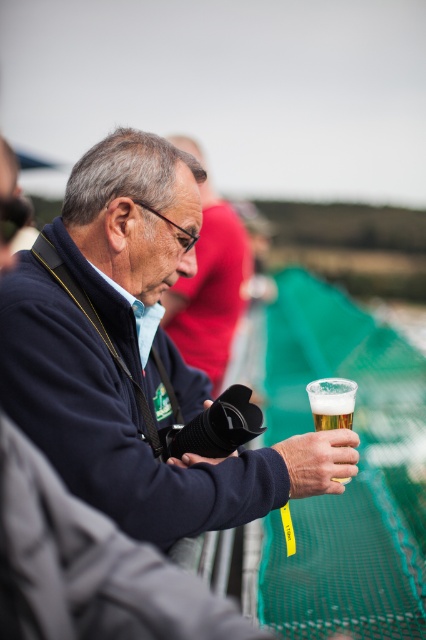
Question: Does matte black jacket at center appear on the right side of matte black camera at center?

Choices:
 (A) no
 (B) yes

Answer: (B)

Question: Based on their relative distances, which object is nearer to the matte black camera at center?

Choices:
 (A) matte black jacket at center
 (B) translucent glass at center

Answer: (A)

Question: Estimate the real-world distances between objects in this image. Which object is closer to the matte black camera at center?

Choices:
 (A) translucent glass at center
 (B) matte black jacket at center

Answer: (B)

Question: Can you confirm if matte black camera at center is smaller than translucent glass at center?

Choices:
 (A) yes
 (B) no

Answer: (B)

Question: Which object is positioned closest to the translucent glass at center?

Choices:
 (A) matte black jacket at center
 (B) matte black camera at center

Answer: (A)

Question: Can you confirm if matte black camera at center is positioned to the left of translucent glass at center?

Choices:
 (A) no
 (B) yes

Answer: (B)